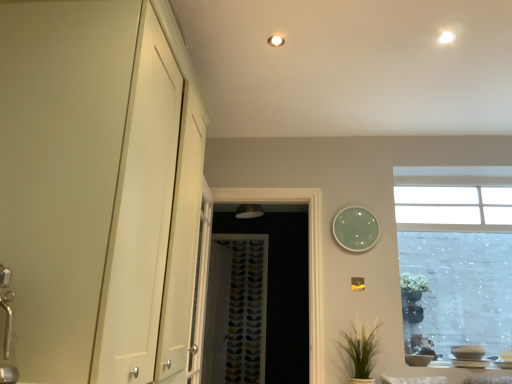
Question: Is the surface of white glossy light fixture at upper right, which is the 1th lighting in front-to-back order, in direct contact with white glossy cabinet at left?

Choices:
 (A) yes
 (B) no

Answer: (B)

Question: Is white glossy light fixture at upper right, the 1th lighting from the right, not near white glossy cabinet at left?

Choices:
 (A) yes
 (B) no

Answer: (A)

Question: Is the depth of white glossy light fixture at upper right, acting as the second lighting starting from the left, greater than that of white glossy cabinet at left?

Choices:
 (A) no
 (B) yes

Answer: (B)

Question: From a real-world perspective, is white glossy light fixture at upper right, arranged as the second lighting when viewed from the back, below white glossy cabinet at left?

Choices:
 (A) no
 (B) yes

Answer: (A)

Question: Could white glossy cabinet at left be considered to be inside white glossy light fixture at upper right, arranged as the second lighting when viewed from the back?

Choices:
 (A) no
 (B) yes

Answer: (A)

Question: From the image's perspective, is green glass clock at upper right above or below white glossy cabinet at left?

Choices:
 (A) above
 (B) below

Answer: (B)

Question: Does point (344, 233) appear closer or farther from the camera than point (195, 180)?

Choices:
 (A) farther
 (B) closer

Answer: (A)

Question: From a real-world perspective, is green glass clock at upper right positioned above or below white glossy cabinet at left?

Choices:
 (A) above
 (B) below

Answer: (A)

Question: In terms of height, does green glass clock at upper right look taller or shorter compared to white glossy cabinet at left?

Choices:
 (A) tall
 (B) short

Answer: (B)

Question: Visually, is green matte plant at lower right positioned to the left or to the right of white glossy light fixture at upper right, arranged as the second lighting when viewed from the back?

Choices:
 (A) left
 (B) right

Answer: (A)

Question: Is point (361, 382) closer or farther from the camera than point (454, 38)?

Choices:
 (A) farther
 (B) closer

Answer: (A)

Question: Looking at their shapes, would you say green matte plant at lower right is wider or thinner than white glossy light fixture at upper right, arranged as the second lighting when viewed from the back?

Choices:
 (A) thin
 (B) wide

Answer: (B)

Question: From a real-world perspective, is green matte plant at lower right physically located above or below white glossy light fixture at upper right, which is the 1th lighting in front-to-back order?

Choices:
 (A) above
 (B) below

Answer: (B)

Question: Considering the positions of white glossy light fixture at upper center, placed as the second lighting when sorted from front to back, and multicolored fabric curtain at center in the image, is white glossy light fixture at upper center, placed as the second lighting when sorted from front to back, taller or shorter than multicolored fabric curtain at center?

Choices:
 (A) short
 (B) tall

Answer: (A)

Question: Is white glossy light fixture at upper center, placed as the second lighting when sorted from front to back, wider or thinner than multicolored fabric curtain at center?

Choices:
 (A) wide
 (B) thin

Answer: (B)